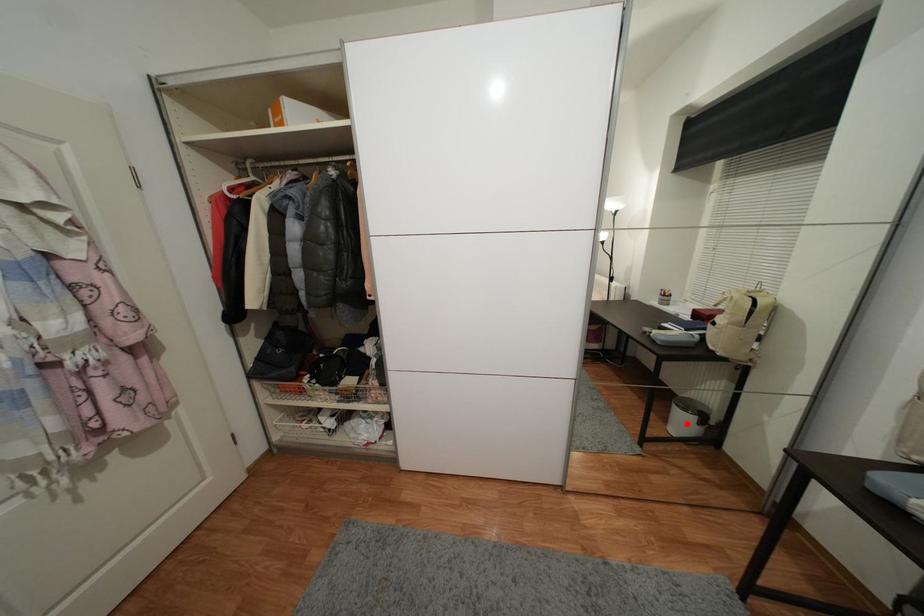
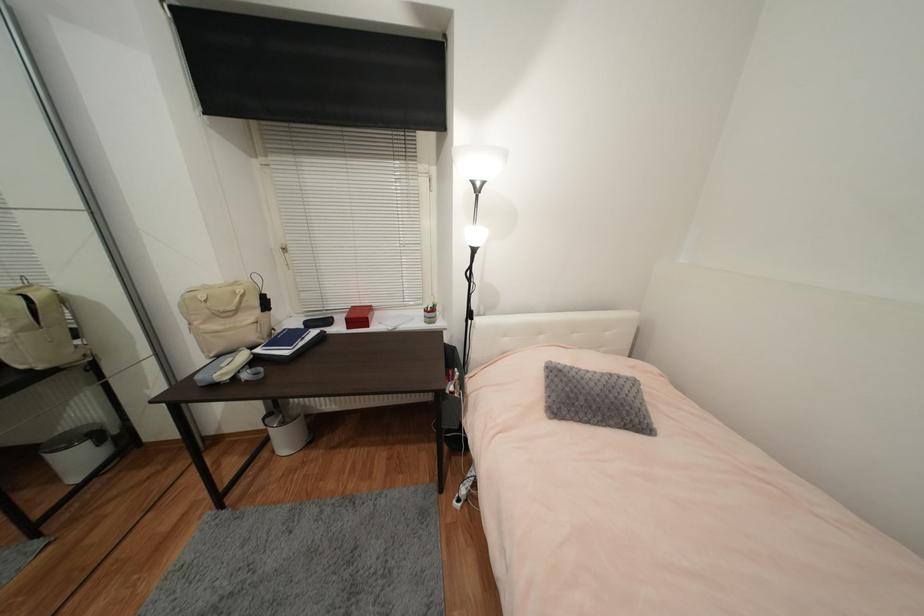
Where in the second image is the point corresponding to the highlighted location from the first image?

(83, 462)